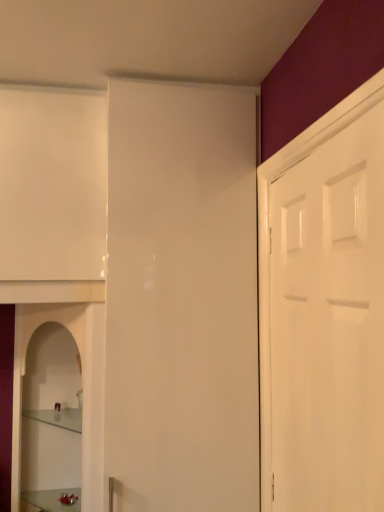
Where is `clear glass shelf at lower left`? clear glass shelf at lower left is located at coordinates (58, 417).

What is the approximate width of metallic silver tray at lower left?

metallic silver tray at lower left is 12.24 inches in width.

Where is `metallic silver tray at lower left`? The image size is (384, 512). metallic silver tray at lower left is located at coordinates (50, 500).

The height and width of the screenshot is (512, 384). Identify the location of clear glass cabinet at lower left. click(x=82, y=387).

Is metallic silver tray at lower left in front of or behind white glossy door at right in the image?

In the image, metallic silver tray at lower left appears behind white glossy door at right.

Is white glossy door at right inside metallic silver tray at lower left?

No, white glossy door at right is not a part of metallic silver tray at lower left.

Which is more to the left, metallic silver tray at lower left or white glossy door at right?

From the viewer's perspective, metallic silver tray at lower left appears more on the left side.

Would you say metallic silver tray at lower left is a long distance from white glossy door at right?

That's right, there is a large distance between metallic silver tray at lower left and white glossy door at right.

From a real-world perspective, between metallic silver tray at lower left and clear glass shelf at lower left, who is vertically lower?

From a 3D spatial view, metallic silver tray at lower left is below.

Does metallic silver tray at lower left appear on the left side of clear glass shelf at lower left?

Incorrect, metallic silver tray at lower left is not on the left side of clear glass shelf at lower left.

From the image's perspective, is metallic silver tray at lower left located above or below clear glass shelf at lower left?

metallic silver tray at lower left is below clear glass shelf at lower left.

Could you tell me if metallic silver tray at lower left is facing clear glass shelf at lower left?

No, metallic silver tray at lower left is not oriented towards clear glass shelf at lower left.

Do you think clear glass shelf at lower left is within white glossy door at right, or outside of it?

clear glass shelf at lower left is located beyond the bounds of white glossy door at right.

What's the angular difference between clear glass shelf at lower left and white glossy door at right's facing directions?

The angle between the facing direction of clear glass shelf at lower left and the facing direction of white glossy door at right is 91.1 degrees.

Measure the distance between clear glass shelf at lower left and white glossy door at right.

The distance of clear glass shelf at lower left from white glossy door at right is 1.15 meters.

Looking at this image, can you confirm if clear glass shelf at lower left is wider than white glossy door at right?

Indeed, clear glass shelf at lower left has a greater width compared to white glossy door at right.

Is white glossy door at right beside clear glass cabinet at lower left?

white glossy door at right and clear glass cabinet at lower left are not in contact.

Does white glossy door at right have a greater height compared to clear glass cabinet at lower left?

Yes.

Identify the location of cabinetry that appears on the left of white glossy door at right. This screenshot has height=512, width=384. (82, 387).

Is clear glass cabinet at lower left turned away from white glossy door at right?

No, clear glass cabinet at lower left is not facing the opposite direction of white glossy door at right.

Between clear glass cabinet at lower left and white glossy door at right, which one has more height?

Standing taller between the two is white glossy door at right.

Considering the positions of objects clear glass cabinet at lower left and white glossy door at right in the image provided, who is more to the right, clear glass cabinet at lower left or white glossy door at right?

white glossy door at right is more to the right.

Which object is further away from the camera, white glossy door at right or clear glass shelf at lower left?

Positioned behind is clear glass shelf at lower left.

This screenshot has height=512, width=384. I want to click on shelf below the white glossy door at right (from the image's perspective), so click(x=58, y=417).

Is white glossy door at right facing away from clear glass shelf at lower left?

white glossy door at right is not turned away from clear glass shelf at lower left.

From the picture: Which object is positioned more to the left, clear glass shelf at lower left or metallic silver tray at lower left?

clear glass shelf at lower left.

Does point (71, 430) come in front of point (49, 508)?

No, it is behind (49, 508).

You are a GUI agent. You are given a task and a screenshot of the screen. Output one action in this format:
    pyautogui.click(x=<x>, y=<y>)
    Task: Click on the furniture in front of the clear glass shelf at lower left
    This screenshot has width=384, height=512.
    Given the screenshot: What is the action you would take?
    pyautogui.click(x=50, y=500)

Find the location of `door lying on the right of metallic silver tray at lower left`. door lying on the right of metallic silver tray at lower left is located at coordinates (327, 322).

At what (x,y) coordinates should I click in order to perform the action: click on shelf that is above the metallic silver tray at lower left (from a real-world perspective). Please return your answer as a coordinate pair (x, y). Looking at the image, I should click on (58, 417).

Estimate the real-world distances between objects in this image. Which object is further from metallic silver tray at lower left, white glossy door at right or clear glass shelf at lower left?

white glossy door at right.

Looking at this image, which object lies further to the anchor point metallic silver tray at lower left, clear glass cabinet at lower left or white glossy door at right?

Based on the image, white glossy door at right appears to be further to metallic silver tray at lower left.

Considering their positions, is white glossy door at right positioned further to metallic silver tray at lower left than clear glass cabinet at lower left?

white glossy door at right is further to metallic silver tray at lower left.

Estimate the real-world distances between objects in this image. Which object is closer to clear glass shelf at lower left, clear glass cabinet at lower left or metallic silver tray at lower left?

metallic silver tray at lower left is closer to clear glass shelf at lower left.

From the image, which object appears to be farther from metallic silver tray at lower left, clear glass cabinet at lower left or clear glass shelf at lower left?

clear glass cabinet at lower left is further to metallic silver tray at lower left.

From the picture: Looking at the image, which one is located closer to clear glass shelf at lower left, metallic silver tray at lower left or white glossy door at right?

Among the two, metallic silver tray at lower left is located nearer to clear glass shelf at lower left.

Looking at the image, which one is located further to white glossy door at right, clear glass cabinet at lower left or clear glass shelf at lower left?

clear glass shelf at lower left is positioned further to the anchor white glossy door at right.

Which object lies nearer to the anchor point white glossy door at right, clear glass shelf at lower left or metallic silver tray at lower left?

Based on the image, clear glass shelf at lower left appears to be nearer to white glossy door at right.

Image resolution: width=384 pixels, height=512 pixels. I want to click on furniture located between clear glass cabinet at lower left and white glossy door at right in the left-right direction, so click(x=50, y=500).

Locate an element on the screen. Image resolution: width=384 pixels, height=512 pixels. shelf between clear glass cabinet at lower left and white glossy door at right from left to right is located at coordinates (58, 417).

Where is `shelf between clear glass cabinet at lower left and metallic silver tray at lower left in the vertical direction`? The width and height of the screenshot is (384, 512). shelf between clear glass cabinet at lower left and metallic silver tray at lower left in the vertical direction is located at coordinates (58, 417).

Where is `furniture located between clear glass shelf at lower left and white glossy door at right in the left-right direction`? furniture located between clear glass shelf at lower left and white glossy door at right in the left-right direction is located at coordinates (50, 500).